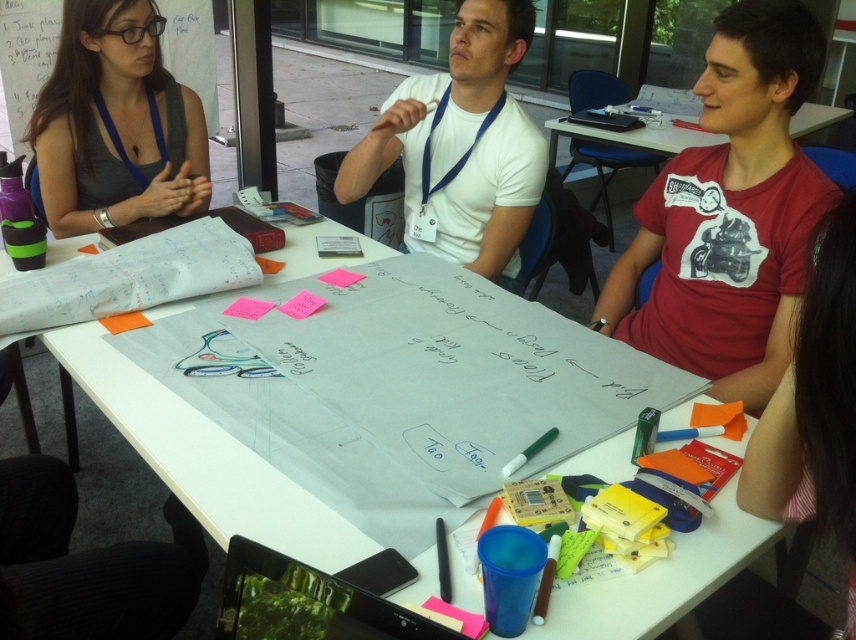
Question: Can you confirm if black fabric chair at lower left is thinner than matte white paper at upper left?

Choices:
 (A) no
 (B) yes

Answer: (A)

Question: Which object is positioned closest to the matte plastic table at center?

Choices:
 (A) red cotton t-shirt at right
 (B) matte white paper at upper left
 (C) black fabric chair at lower left
 (D) white smooth t-shirt at center

Answer: (D)

Question: Does black fabric chair at lower left appear on the right side of matte plastic table at center?

Choices:
 (A) yes
 (B) no

Answer: (B)

Question: Among these points, which one is farthest from the camera?

Choices:
 (A) (812, 116)
 (B) (22, 67)
 (C) (27, 547)
 (D) (177, 444)

Answer: (A)

Question: Does red cotton t-shirt at right appear on the right side of matte white paper at upper left?

Choices:
 (A) yes
 (B) no

Answer: (A)

Question: Which object is the farthest from the black fabric chair at lower left?

Choices:
 (A) white smooth t-shirt at center
 (B) red cotton t-shirt at right
 (C) matte plastic table at center

Answer: (C)